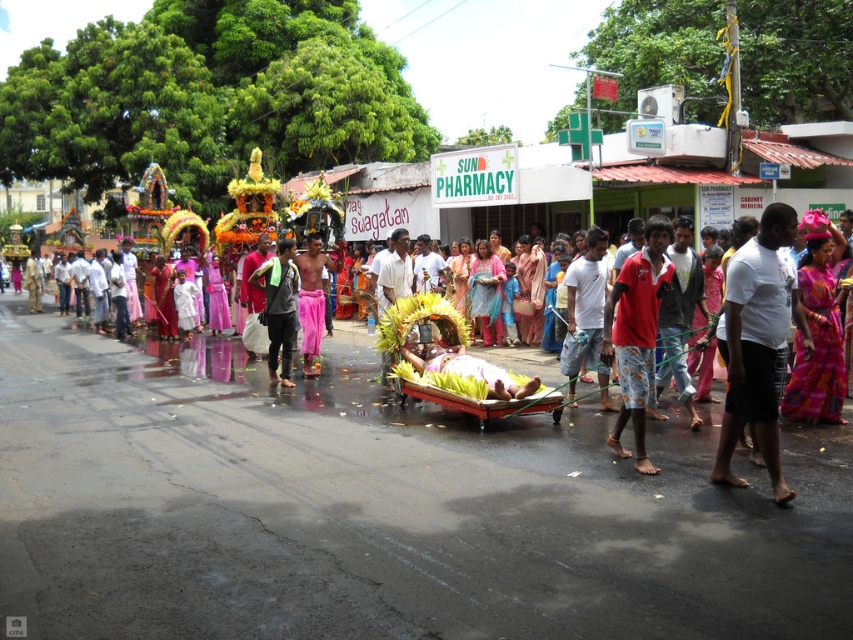
Question: Does white cotton shirt at center lie behind green leafy bed at center?

Choices:
 (A) no
 (B) yes

Answer: (A)

Question: Which of these objects is positioned farthest from the silky pink saree at right?

Choices:
 (A) red cotton shirt at center
 (B) green leafy bed at center

Answer: (B)

Question: Estimate the real-world distances between objects in this image. Which object is farther from the wooden cart at center?

Choices:
 (A) white cotton shirt at center
 (B) green leafy bed at center

Answer: (A)

Question: Can you confirm if white cotton shirt at center is positioned to the right of green leafy bed at center?

Choices:
 (A) no
 (B) yes

Answer: (B)

Question: Among these points, which one is nearest to the camera?

Choices:
 (A) (498, 403)
 (B) (788, 225)
 (C) (642, 317)
 (D) (311, 326)

Answer: (B)

Question: Is wooden cart at center above green leafy bed at center?

Choices:
 (A) yes
 (B) no

Answer: (B)